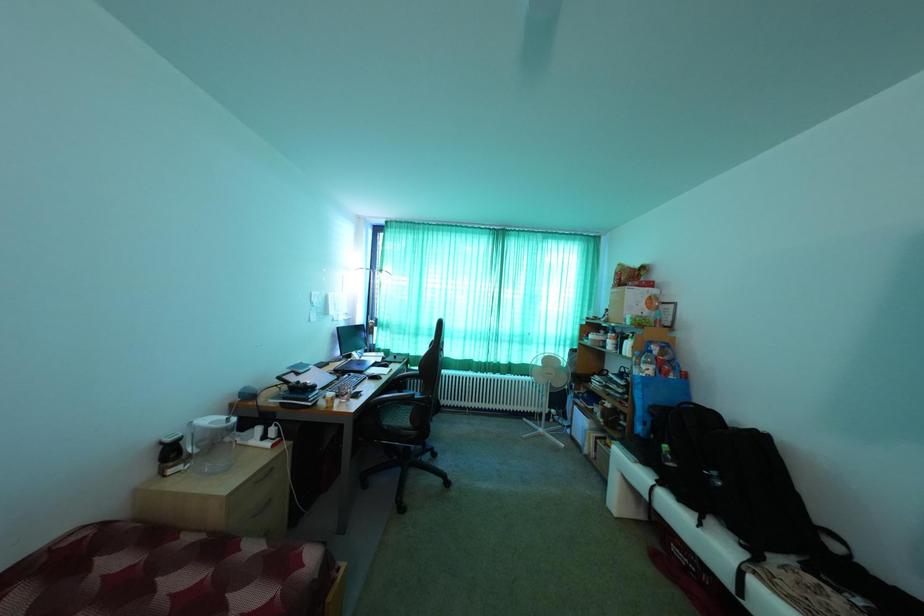
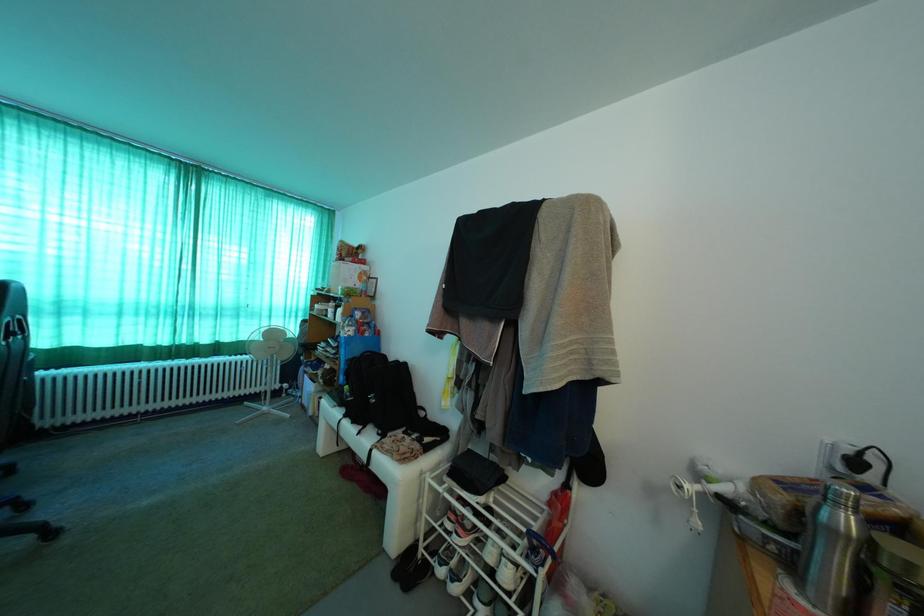
Question: The camera is either moving clockwise (left) or counter-clockwise (right) around the object. The first image is from the beginning of the video and the second image is from the end. Is the camera moving left or right when shooting the video?

Choices:
 (A) Left
 (B) Right

Answer: (A)